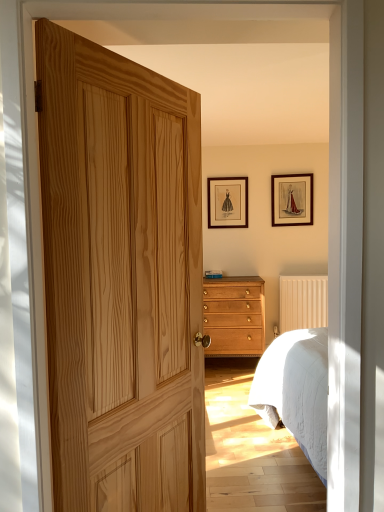
Question: From a real-world perspective, is natural wood door at center under matte black picture frame at upper center, which is the 1th picture frame from left to right?

Choices:
 (A) yes
 (B) no

Answer: (A)

Question: Can you confirm if natural wood door at center is bigger than matte black picture frame at upper center, marked as the second picture frame in a right-to-left arrangement?

Choices:
 (A) yes
 (B) no

Answer: (A)

Question: Is natural wood door at center aimed at matte black picture frame at upper center, which is the 1th picture frame from left to right?

Choices:
 (A) yes
 (B) no

Answer: (B)

Question: Considering the relative sizes of natural wood door at center and matte black picture frame at upper center, marked as the second picture frame in a right-to-left arrangement, in the image provided, is natural wood door at center shorter than matte black picture frame at upper center, marked as the second picture frame in a right-to-left arrangement,?

Choices:
 (A) yes
 (B) no

Answer: (B)

Question: From the image's perspective, is natural wood door at center over matte black picture frame at upper center, which is the 1th picture frame from left to right?

Choices:
 (A) no
 (B) yes

Answer: (A)

Question: Based on their sizes in the image, would you say wooden picture frame at upper right, acting as the 1th picture frame starting from the right, is bigger or smaller than natural wood door at center?

Choices:
 (A) small
 (B) big

Answer: (A)

Question: From a real-world perspective, relative to natural wood door at center, is wooden picture frame at upper right, the 2th picture frame from the left, vertically above or below?

Choices:
 (A) above
 (B) below

Answer: (A)

Question: Considering their positions, is wooden picture frame at upper right, acting as the 1th picture frame starting from the right, located in front of or behind natural wood door at center?

Choices:
 (A) front
 (B) behind

Answer: (B)

Question: Which is correct: wooden picture frame at upper right, acting as the 1th picture frame starting from the right, is inside natural wood door at center, or outside of it?

Choices:
 (A) inside
 (B) outside

Answer: (B)

Question: In terms of height, does natural wood door at center look taller or shorter compared to beige textured radiator at center right?

Choices:
 (A) tall
 (B) short

Answer: (A)

Question: Is natural wood door at center in front of or behind beige textured radiator at center right in the image?

Choices:
 (A) behind
 (B) front

Answer: (B)

Question: Is natural wood door at center situated inside beige textured radiator at center right or outside?

Choices:
 (A) outside
 (B) inside

Answer: (A)

Question: From the image's perspective, relative to beige textured radiator at center right, is natural wood door at center above or below?

Choices:
 (A) above
 (B) below

Answer: (A)

Question: Would you say light brown wood chest of drawers at center is inside or outside natural wood door at center?

Choices:
 (A) outside
 (B) inside

Answer: (A)

Question: Considering the positions of light brown wood chest of drawers at center and natural wood door at center in the image, is light brown wood chest of drawers at center bigger or smaller than natural wood door at center?

Choices:
 (A) big
 (B) small

Answer: (A)